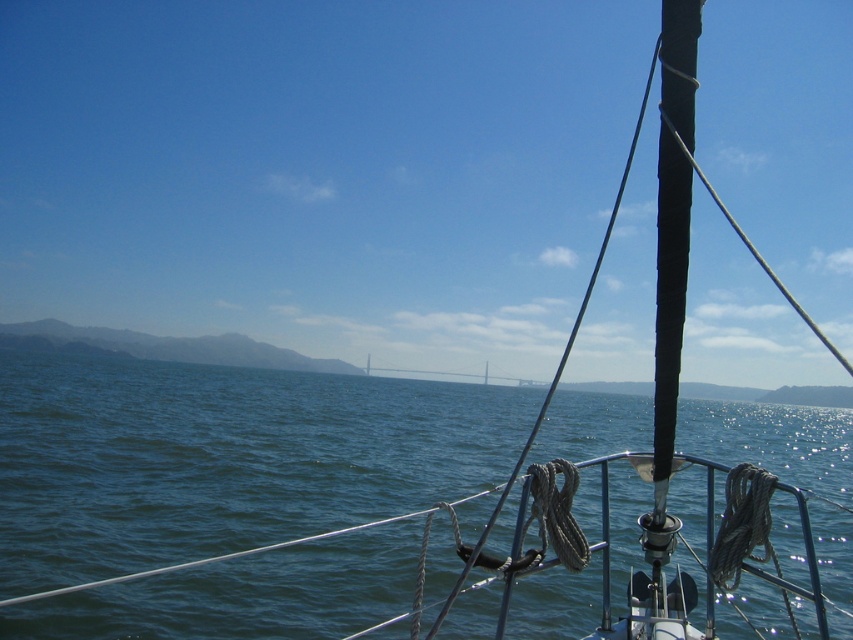
Can you confirm if blue water at center is taller than gray metallic bridge at center?

Yes.

Which is above, blue water at center or gray metallic bridge at center?

Positioned higher is blue water at center.

Is point (349, 404) behind point (410, 369)?

No, (349, 404) is in front of (410, 369).

Locate an element on the screen. blue water at center is located at coordinates (221, 458).